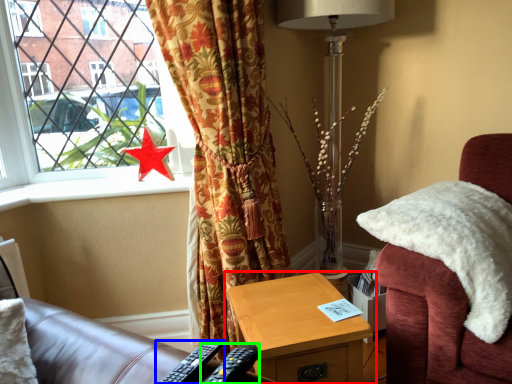
Question: Estimate the real-world distances between objects in this image. Which object is closer to nightstand (highlighted by a red box), remote control (highlighted by a blue box) or remote control (highlighted by a green box)?

Choices:
 (A) remote control
 (B) remote control

Answer: (B)